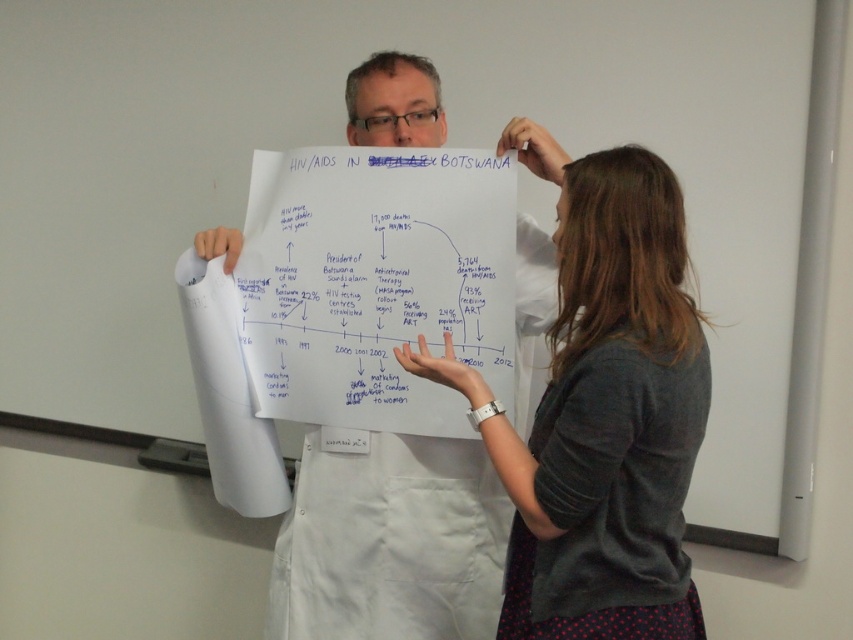
Which is below, gray cotton shirt at center or white paper at center?

Positioned lower is gray cotton shirt at center.

Does point (619, 241) lie in front of point (396, 563)?

Yes, point (619, 241) is closer to viewer.

Identify the location of gray cotton shirt at center. (602, 419).